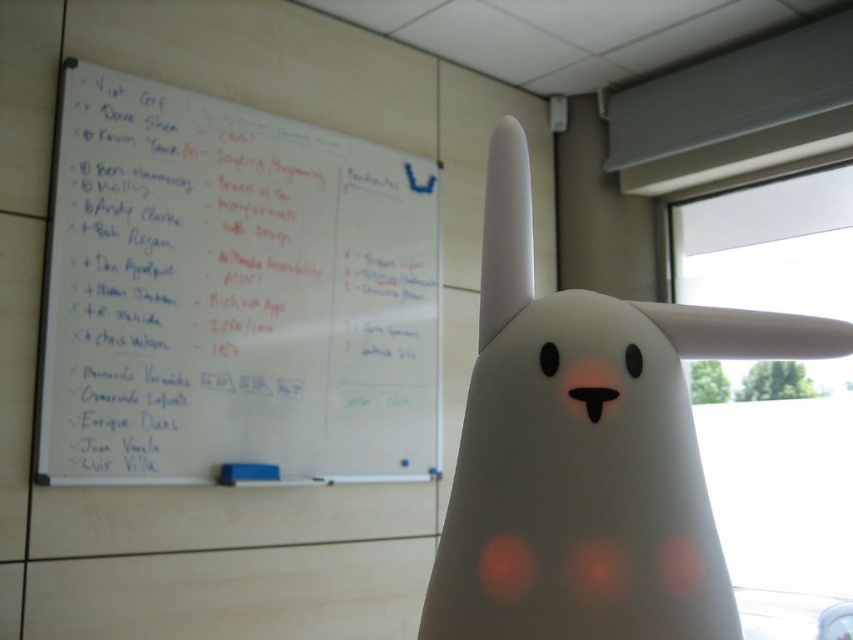
Locate an element on the screen. The image size is (853, 640). white matte whiteboard at upper left is located at coordinates (233, 294).

Where is `white matte whiteboard at upper left`? white matte whiteboard at upper left is located at coordinates (233, 294).